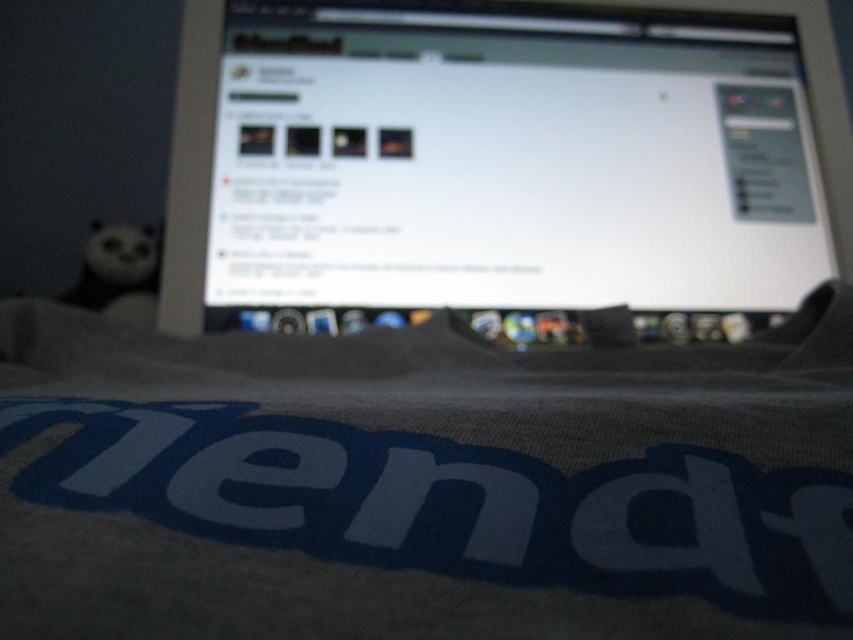
You are organizing your desk and want to place the black plush panda at left on the matte plastic monitor at center. Is there enough space for the panda to fit on the monitor?

The matte plastic monitor at center is positioned over the black plush panda at left, so the panda is already placed on the monitor and there is enough space.

You are setting up a desk and want to place both the matte plastic monitor at center and the black plush panda at left on the desk. Given their sizes, which object should you place first to ensure they both fit?

The matte plastic monitor at center is bigger than the black plush panda at left, so you should place the matte plastic monitor at center first to ensure there is enough space for both.

You are a person with 20.20 vision standing at a distance from the matte plastic monitor at center. Can you read the text on the monitor clearly?

The matte plastic monitor at center and viewer are 34.32 inches apart. Since the text is slightly out of focus due to the shallow depth of field as mentioned in the scene, even at this distance, the text might still be blurry and difficult to read clearly.